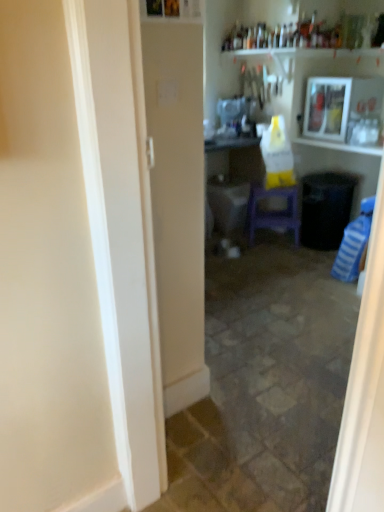
Question: Is purple plastic stool at center wider or thinner than wooden framed picture at upper right?

Choices:
 (A) wide
 (B) thin

Answer: (B)

Question: In terms of height, does purple plastic stool at center look taller or shorter compared to wooden framed picture at upper right?

Choices:
 (A) short
 (B) tall

Answer: (B)

Question: Based on their relative distances, which object is farther from the wooden framed picture at upper right?

Choices:
 (A) white glossy sink at center
 (B) purple plastic stool at center

Answer: (B)

Question: Which object is positioned closest to the white glossy sink at center?

Choices:
 (A) wooden framed picture at upper right
 (B) purple plastic stool at center

Answer: (A)